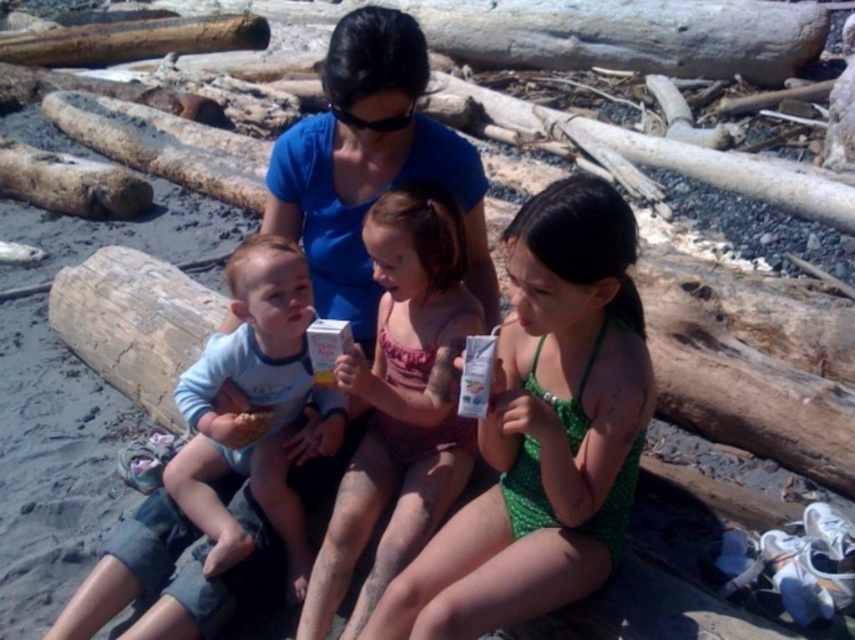
Does pink fabric swimsuit at center appear on the left side of light blue cotton shirt at center?

Incorrect, pink fabric swimsuit at center is not on the left side of light blue cotton shirt at center.

Who is shorter, pink fabric swimsuit at center or light blue cotton shirt at center?

light blue cotton shirt at center

Where is `pink fabric swimsuit at center`? The width and height of the screenshot is (855, 640). pink fabric swimsuit at center is located at coordinates (544, 429).

You are a GUI agent. You are given a task and a screenshot of the screen. Output one action in this format:
    pyautogui.click(x=<x>, y=<y>)
    Task: Click on the pink fabric swimsuit at center
    The image size is (855, 640).
    Given the screenshot: What is the action you would take?
    pyautogui.click(x=544, y=429)

Is matte pink swimsuit at center positioned behind light blue cotton shirt at center?

No, matte pink swimsuit at center is in front of light blue cotton shirt at center.

Does point (426, 486) come behind point (254, 461)?

That is False.

The image size is (855, 640). Find the location of `matte pink swimsuit at center`. matte pink swimsuit at center is located at coordinates (399, 401).

Can you confirm if pink fabric swimsuit at center is positioned to the left of matte pink swimsuit at center?

No, pink fabric swimsuit at center is not to the left of matte pink swimsuit at center.

Who is more forward, (614, 209) or (411, 397)?

Positioned in front is point (614, 209).

Does point (453, 589) come closer to viewer compared to point (429, 468)?

Yes, point (453, 589) is closer to viewer.

Identify the location of pink fabric swimsuit at center. (544, 429).